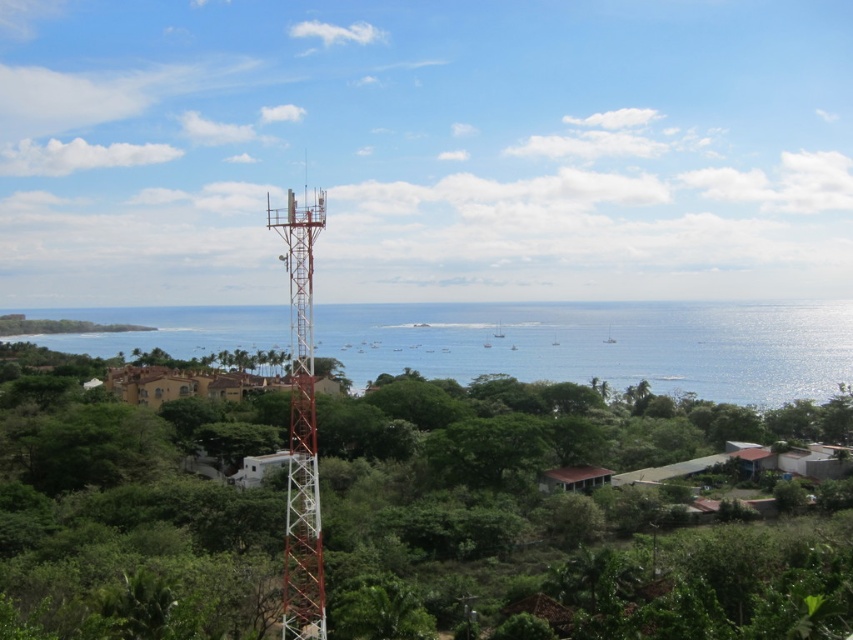
Question: Among these points, which one is farthest from the camera?

Choices:
 (A) (364, 618)
 (B) (547, 348)

Answer: (B)

Question: Based on their relative distances, which object is farther from the blue water at center?

Choices:
 (A) rustic metal tower at center
 (B) green leafy tree at center

Answer: (A)

Question: Among these points, which one is farthest from the camera?

Choices:
 (A) (294, 378)
 (B) (409, 620)

Answer: (B)

Question: Can you confirm if blue water at center is smaller than rustic metal tower at center?

Choices:
 (A) no
 (B) yes

Answer: (A)

Question: Does green leafy tree at center have a larger size compared to blue water at center?

Choices:
 (A) yes
 (B) no

Answer: (B)

Question: Is green leafy tree at center further to camera compared to rustic metal tower at center?

Choices:
 (A) no
 (B) yes

Answer: (B)